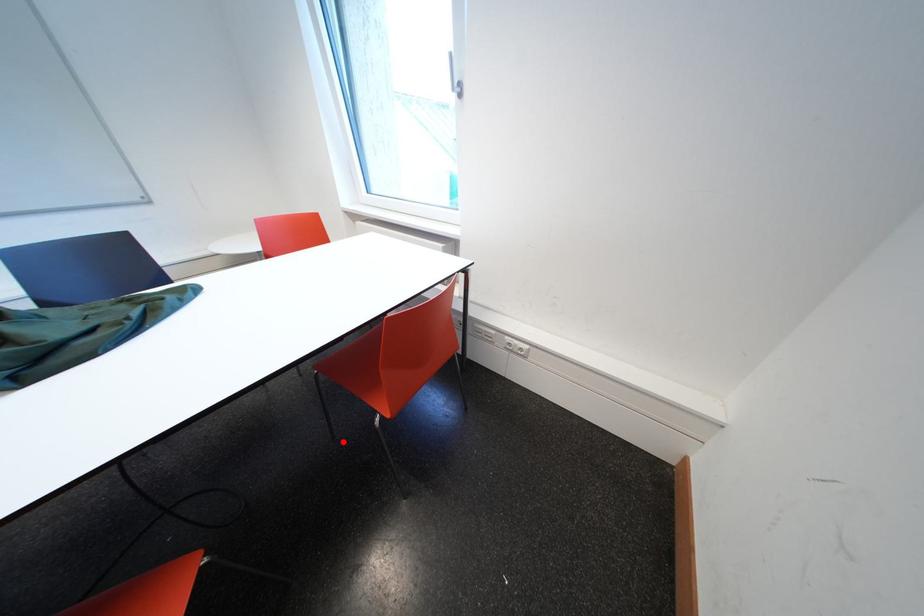
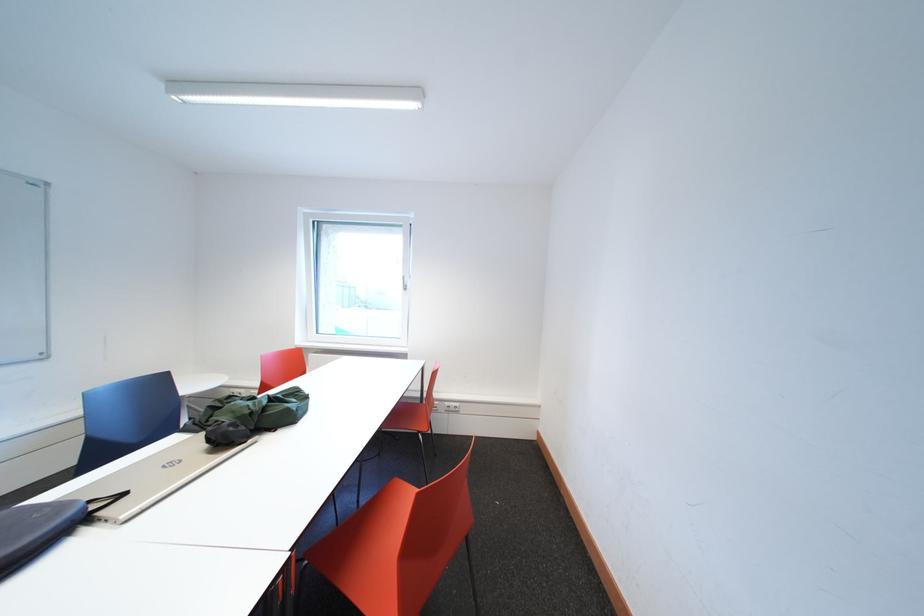
Question: I am providing you with two images of the same scene from different viewpoints. In image1, a red point is highlighted. Considering the same 3D point in image2, which of the following is correct?

Choices:
 (A) It is closer
 (B) It is farther

Answer: (A)